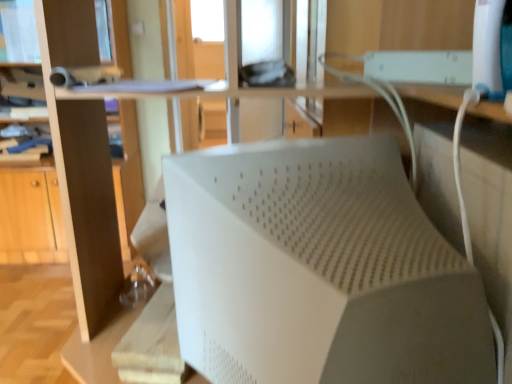
This screenshot has width=512, height=384. Find the location of `matte brown bookshelf at left`. matte brown bookshelf at left is located at coordinates (78, 206).

What do you see at coordinates (78, 206) in the screenshot? I see `matte brown bookshelf at left` at bounding box center [78, 206].

Where is `white matte speaker at center`? This screenshot has width=512, height=384. white matte speaker at center is located at coordinates (318, 269).

The width and height of the screenshot is (512, 384). What do you see at coordinates (318, 269) in the screenshot?
I see `white matte speaker at center` at bounding box center [318, 269].

You are a GUI agent. You are given a task and a screenshot of the screen. Output one action in this format:
    pyautogui.click(x=<x>, y=<y>)
    Task: Click on the matte brown bookshelf at left
    
    Given the screenshot: What is the action you would take?
    pyautogui.click(x=78, y=206)

Visually, is matte brown bookshelf at left positioned to the left or to the right of white matte speaker at center?

matte brown bookshelf at left is to the left of white matte speaker at center.

In the image, is matte brown bookshelf at left positioned in front of or behind white matte speaker at center?

Clearly, matte brown bookshelf at left is behind white matte speaker at center.

Considering the positions of point (120, 238) and point (242, 156), is point (120, 238) closer or farther from the camera than point (242, 156)?

Clearly, point (120, 238) is more distant from the camera than point (242, 156).

From the image's perspective, is matte brown bookshelf at left beneath white matte speaker at center?

Actually, matte brown bookshelf at left appears above white matte speaker at center in the image.

From a real-world perspective, between matte brown bookshelf at left and white matte speaker at center, who is vertically lower?

matte brown bookshelf at left.

Does matte brown bookshelf at left have a greater width compared to white matte speaker at center?

Indeed, matte brown bookshelf at left has a greater width compared to white matte speaker at center.

Between matte brown bookshelf at left and white matte speaker at center, which one has more height?

matte brown bookshelf at left.

Which of these two, matte brown bookshelf at left or white matte speaker at center, is smaller?

With smaller size is white matte speaker at center.

Would you say matte brown bookshelf at left is inside or outside white matte speaker at center?

matte brown bookshelf at left is not inside white matte speaker at center, it's outside.

Is there a large distance between matte brown bookshelf at left and white matte speaker at center?

Yes.

Could you tell me if matte brown bookshelf at left is turned towards white matte speaker at center?

No, matte brown bookshelf at left is not aimed at white matte speaker at center.

Based on the photo, how different are the orientations of matte brown bookshelf at left and white matte speaker at center in degrees?

There is a 167-degree angle between the facing directions of matte brown bookshelf at left and white matte speaker at center.

Based on the photo, how far apart are matte brown bookshelf at left and white matte speaker at center?

matte brown bookshelf at left is 8.01 feet from white matte speaker at center.

Find the location of a particular element. The image size is (512, 384). bookshelf below the white matte speaker at center (from a real-world perspective) is located at coordinates (78, 206).

Based on the photo, is white matte speaker at center at the right side of matte brown bookshelf at left?

Yes, white matte speaker at center is to the right of matte brown bookshelf at left.

From the picture: Does white matte speaker at center come behind matte brown bookshelf at left?

No, white matte speaker at center is in front of matte brown bookshelf at left.

Between point (369, 182) and point (54, 32), which one is positioned behind?

The point (54, 32) is farther.

From the image's perspective, is white matte speaker at center above or below matte brown bookshelf at left?

Based on their image positions, white matte speaker at center is located beneath matte brown bookshelf at left.

From a real-world perspective, who is located higher, white matte speaker at center or matte brown bookshelf at left?

white matte speaker at center is physically above.

Which object is wider, white matte speaker at center or matte brown bookshelf at left?

matte brown bookshelf at left.

Which of these two, white matte speaker at center or matte brown bookshelf at left, stands shorter?

white matte speaker at center.

Based on their sizes in the image, would you say white matte speaker at center is bigger or smaller than matte brown bookshelf at left?

Clearly, white matte speaker at center is smaller in size than matte brown bookshelf at left.

Is white matte speaker at center outside of matte brown bookshelf at left?

That's correct, white matte speaker at center is outside of matte brown bookshelf at left.

Does white matte speaker at center touch matte brown bookshelf at left?

No, white matte speaker at center is not touching matte brown bookshelf at left.

Is white matte speaker at center turned away from matte brown bookshelf at left?

white matte speaker at center does not have its back to matte brown bookshelf at left.

Identify the location of wide that is on the right side of matte brown bookshelf at left. Image resolution: width=512 pixels, height=384 pixels. (318, 269).

Image resolution: width=512 pixels, height=384 pixels. Find the location of `bookshelf above the white matte speaker at center (from the image's perspective)`. bookshelf above the white matte speaker at center (from the image's perspective) is located at coordinates (78, 206).

Identify the location of wide that appears on the right of matte brown bookshelf at left. The height and width of the screenshot is (384, 512). (318, 269).